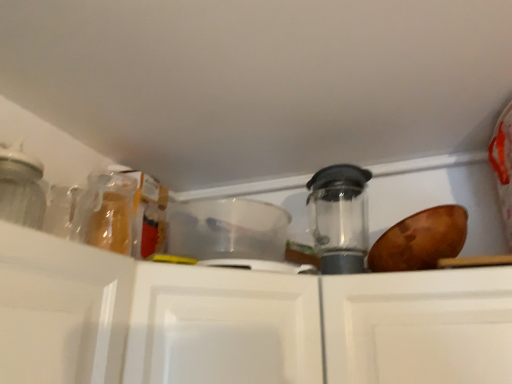
Question: Is white matte cabinet at center touching transparent plastic container at center, placed as the first appliance when sorted from left to right?

Choices:
 (A) yes
 (B) no

Answer: (B)

Question: Is white matte cabinet at center positioned in front of transparent plastic container at center, placed as the first appliance when sorted from left to right?

Choices:
 (A) yes
 (B) no

Answer: (A)

Question: Is white matte cabinet at center turned away from transparent plastic container at center, placed as the 2th appliance when sorted from right to left?

Choices:
 (A) yes
 (B) no

Answer: (B)

Question: Considering the relative positions of white matte cabinet at center and transparent plastic container at center, placed as the 2th appliance when sorted from right to left, in the image provided, is white matte cabinet at center to the right of transparent plastic container at center, placed as the 2th appliance when sorted from right to left, from the viewer's perspective?

Choices:
 (A) no
 (B) yes

Answer: (A)

Question: Can you confirm if white matte cabinet at center is smaller than transparent plastic container at center, placed as the first appliance when sorted from left to right?

Choices:
 (A) no
 (B) yes

Answer: (A)

Question: Considering their positions, is transparent plastic blender at center, arranged as the second appliance when viewed from the left, located in front of or behind white matte cabinet at center?

Choices:
 (A) behind
 (B) front

Answer: (A)

Question: Is transparent plastic blender at center, arranged as the second appliance when viewed from the left, wider or thinner than white matte cabinet at center?

Choices:
 (A) wide
 (B) thin

Answer: (B)

Question: From the image's perspective, relative to white matte cabinet at center, is transparent plastic blender at center, arranged as the second appliance when viewed from the left, above or below?

Choices:
 (A) above
 (B) below

Answer: (A)

Question: In the image, is transparent plastic blender at center, arranged as the second appliance when viewed from the left, on the left side or the right side of white matte cabinet at center?

Choices:
 (A) right
 (B) left

Answer: (A)

Question: Based on their sizes in the image, would you say transparent plastic container at center, placed as the 2th appliance when sorted from right to left, is bigger or smaller than transparent plastic blender at center, positioned as the 1th appliance in right-to-left order?

Choices:
 (A) big
 (B) small

Answer: (B)

Question: From the image's perspective, is transparent plastic container at center, placed as the 2th appliance when sorted from right to left, positioned above or below transparent plastic blender at center, arranged as the second appliance when viewed from the left?

Choices:
 (A) below
 (B) above

Answer: (A)

Question: Looking at their shapes, would you say transparent plastic container at center, placed as the first appliance when sorted from left to right, is wider or thinner than transparent plastic blender at center, positioned as the 1th appliance in right-to-left order?

Choices:
 (A) wide
 (B) thin

Answer: (A)

Question: From their relative heights in the image, would you say transparent plastic container at center, placed as the first appliance when sorted from left to right, is taller or shorter than transparent plastic blender at center, positioned as the 1th appliance in right-to-left order?

Choices:
 (A) tall
 (B) short

Answer: (B)

Question: From a real-world perspective, is white matte cabinet at center physically located above or below transparent plastic container at center, placed as the 2th appliance when sorted from right to left?

Choices:
 (A) below
 (B) above

Answer: (A)

Question: In the image, is white matte cabinet at center on the left side or the right side of transparent plastic container at center, placed as the first appliance when sorted from left to right?

Choices:
 (A) left
 (B) right

Answer: (A)